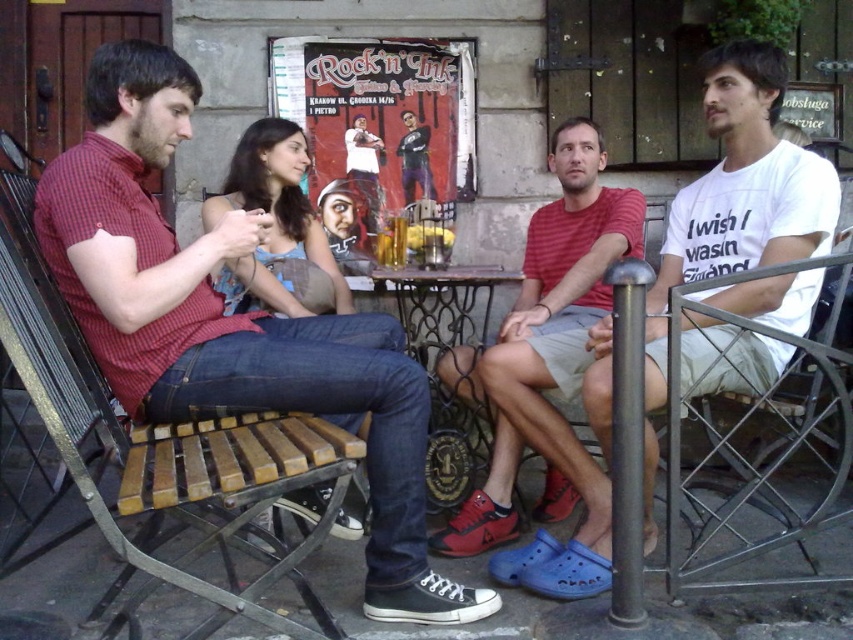
Based on the photo, can you confirm if wooden slats chair at left is positioned to the right of red striped shirt at center?

No, wooden slats chair at left is not to the right of red striped shirt at center.

Which is below, wooden slats chair at left or red striped shirt at center?

Positioned lower is wooden slats chair at left.

This screenshot has height=640, width=853. Find the location of `wooden slats chair at left`. wooden slats chair at left is located at coordinates (227, 497).

The height and width of the screenshot is (640, 853). What are the coordinates of `wooden slats chair at left` in the screenshot? It's located at (227, 497).

Is point (610, 289) closer to viewer compared to point (434, 372)?

Yes, it is.

Who is more distant from viewer, (480, 524) or (473, 296)?

Positioned behind is point (473, 296).

The image size is (853, 640). What are the coordinates of `red striped shirt at center` in the screenshot? It's located at (573, 240).

Can you confirm if metallic wire chair at right is positioned below metallic wrought iron table at center?

Correct, metallic wire chair at right is located below metallic wrought iron table at center.

Is point (773, 412) closer to camera compared to point (422, 332)?

Yes, point (773, 412) is closer to viewer.

Find the location of a particular element. This screenshot has width=853, height=640. metallic wire chair at right is located at coordinates (755, 468).